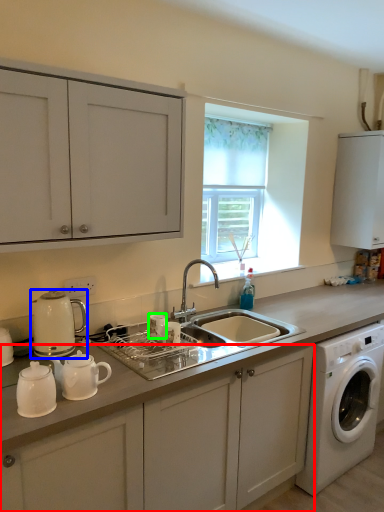
Question: Which object is the farthest from cabinetry (highlighted by a red box)? Choose among these: coffeepot (highlighted by a blue box) or appliance (highlighted by a green box).

Choices:
 (A) coffeepot
 (B) appliance

Answer: (A)